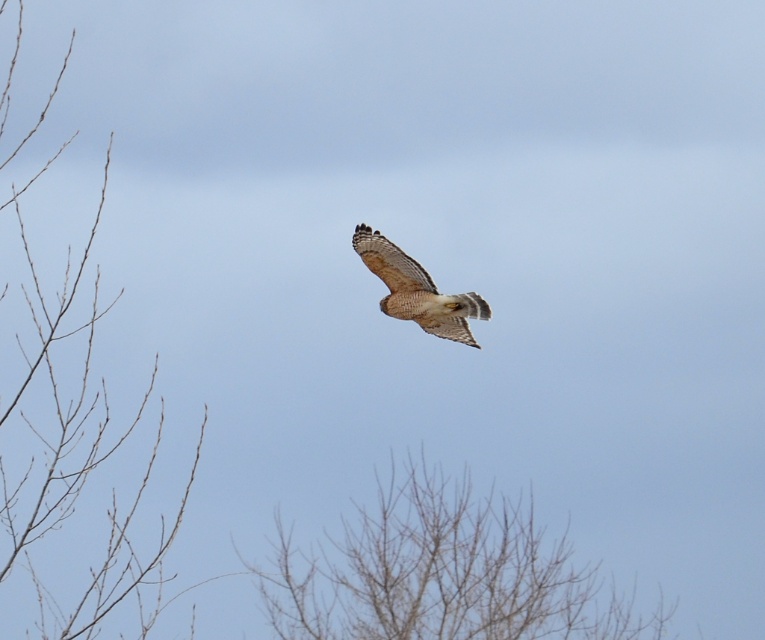
Which is behind, point (353, 536) or point (31, 518)?

Positioned behind is point (353, 536).

Can you confirm if bare branches at center is positioned below bare branches at left?

Yes.

Who is more forward, (431, 584) or (21, 225)?

Point (21, 225)

I want to click on bare branches at center, so click(441, 572).

Is bare branches at left smaller than brown feathered eagle at center?

No.

Which is below, bare branches at left or brown feathered eagle at center?

bare branches at left

Describe the element at coordinates (76, 456) in the screenshot. I see `bare branches at left` at that location.

The width and height of the screenshot is (765, 640). What are the coordinates of `bare branches at left` in the screenshot? It's located at (76, 456).

Where is `bare branches at center`? The image size is (765, 640). bare branches at center is located at coordinates (441, 572).

Does bare branches at center have a lesser width compared to brown feathered eagle at center?

No, bare branches at center is not thinner than brown feathered eagle at center.

Measure the distance between bare branches at center and camera.

bare branches at center is 17.31 meters away from camera.

Image resolution: width=765 pixels, height=640 pixels. Identify the location of bare branches at center. (441, 572).